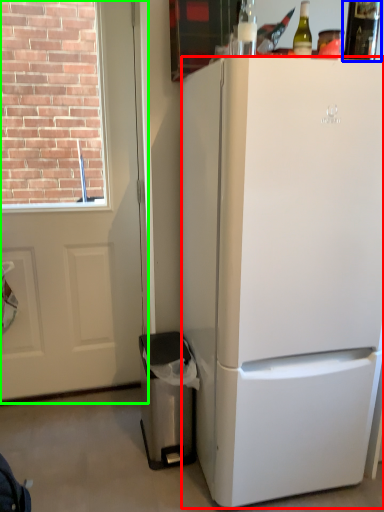
Question: Which object is the closest to the refrigerator (highlighted by a red box)? Choose among these: bottle (highlighted by a blue box) or screen door (highlighted by a green box).

Choices:
 (A) bottle
 (B) screen door

Answer: (A)